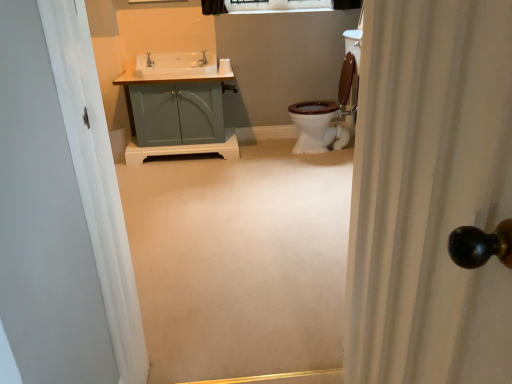
The height and width of the screenshot is (384, 512). Describe the element at coordinates (202, 60) in the screenshot. I see `matte silver faucet at upper center` at that location.

What is the approximate height of white glossy sink at upper left?

The height of white glossy sink at upper left is 7.50 inches.

Describe the element at coordinates (175, 64) in the screenshot. I see `white glossy sink at upper left` at that location.

This screenshot has height=384, width=512. What do you see at coordinates (177, 108) in the screenshot?
I see `matte teal cabinet at center` at bounding box center [177, 108].

This screenshot has width=512, height=384. Identify the location of matte teal cabinet at center. (177, 108).

Locate an element on the screen. matte silver faucet at upper center is located at coordinates (202, 60).

Considering the relative sizes of white textured shower curtain at right and white matte toilet paper at upper center in the image provided, is white textured shower curtain at right smaller than white matte toilet paper at upper center?

No.

Is white textured shower curtain at right next to white matte toilet paper at upper center?

No, white textured shower curtain at right is not beside white matte toilet paper at upper center.

Is the depth of white textured shower curtain at right less than that of white matte toilet paper at upper center?

Yes, the depth of white textured shower curtain at right is less than that of white matte toilet paper at upper center.

Does white textured shower curtain at right turn towards white matte toilet paper at upper center?

Result: No, white textured shower curtain at right is not facing towards white matte toilet paper at upper center.

What's the angular difference between white textured shower curtain at right and white glossy sink at upper left's facing directions?

The facing directions of white textured shower curtain at right and white glossy sink at upper left are 91.6 degrees apart.

Identify the location of shower curtain in front of the white glossy sink at upper left. The width and height of the screenshot is (512, 384). (430, 193).

Does white textured shower curtain at right appear on the right side of white glossy sink at upper left?

Correct, you'll find white textured shower curtain at right to the right of white glossy sink at upper left.

Is white textured shower curtain at right in contact with white glossy sink at upper left?

No, white textured shower curtain at right is not beside white glossy sink at upper left.

Which point is more distant from viewer, (156,108) or (197,65)?

The point (197,65) is farther.

Is matte teal cabinet at center located outside matte silver faucet at upper center?

Indeed, matte teal cabinet at center is completely outside matte silver faucet at upper center.

Is matte teal cabinet at center aimed at matte silver faucet at upper center?

No, matte teal cabinet at center is not aimed at matte silver faucet at upper center.

Considering the positions of objects matte teal cabinet at center and matte silver faucet at upper center in the image provided, who is more to the right, matte teal cabinet at center or matte silver faucet at upper center?

Positioned to the right is matte silver faucet at upper center.

Which is correct: clear glass window at upper center is inside matte teal cabinet at center, or outside of it?

clear glass window at upper center is spatially situated outside matte teal cabinet at center.

Is point (319, 2) behind point (158, 57)?

Yes, point (319, 2) is behind point (158, 57).

Relative to matte teal cabinet at center, is clear glass window at upper center in front or behind?

clear glass window at upper center is behind matte teal cabinet at center.

Looking at this image, from the image's perspective, is white glossy sink at upper left located above or below matte teal cabinet at center?

Based on their image positions, white glossy sink at upper left is located above matte teal cabinet at center.

Measure the distance from white glossy sink at upper left to matte teal cabinet at center.

white glossy sink at upper left is 9.07 inches from matte teal cabinet at center.

Considering the relative positions of white glossy sink at upper left and matte teal cabinet at center in the image provided, is white glossy sink at upper left to the right of matte teal cabinet at center from the viewer's perspective?

Incorrect, white glossy sink at upper left is not on the right side of matte teal cabinet at center.

Considering the sizes of objects matte teal cabinet at center and white glossy sink at upper left in the image provided, who is bigger, matte teal cabinet at center or white glossy sink at upper left?

With larger size is matte teal cabinet at center.

Is matte teal cabinet at center at the left side of white glossy sink at upper left?

No.

Is matte teal cabinet at center taller or shorter than white glossy sink at upper left?

Considering their sizes, matte teal cabinet at center has more height than white glossy sink at upper left.

Where is `bathroom cabinet in front of the white glossy sink at upper left`? Image resolution: width=512 pixels, height=384 pixels. bathroom cabinet in front of the white glossy sink at upper left is located at coordinates (177, 108).

How different are the orientations of white textured shower curtain at right and matte silver faucet at upper left in degrees?

178 degrees separate the facing orientations of white textured shower curtain at right and matte silver faucet at upper left.

Does white textured shower curtain at right have a lesser height compared to matte silver faucet at upper left?

Incorrect, the height of white textured shower curtain at right does not fall short of that of matte silver faucet at upper left.

Does white textured shower curtain at right lie behind matte silver faucet at upper left?

No, it is in front of matte silver faucet at upper left.

In the scene shown: Which of these two, white textured shower curtain at right or matte silver faucet at upper left, is thinner?

matte silver faucet at upper left is thinner.

You are a GUI agent. You are given a task and a screenshot of the screen. Output one action in this format:
    pyautogui.click(x=<x>, y=<y>)
    Task: Click on the shower curtain in front of the white matte toilet paper at upper center
    Image resolution: width=512 pixels, height=384 pixels.
    Given the screenshot: What is the action you would take?
    pyautogui.click(x=430, y=193)

I want to click on sink behind the white textured shower curtain at right, so click(175, 64).

Looking at the image, which one is located further to matte silver faucet at upper left, white glossy sink at upper left or clear glass window at upper center?

clear glass window at upper center lies further to matte silver faucet at upper left than the other object.

Looking at this image, based on their spatial positions, is matte silver faucet at upper left or matte silver faucet at upper center further from white matte toilet paper at upper center?

matte silver faucet at upper left is further to white matte toilet paper at upper center.

Looking at the image, which one is located further to matte teal cabinet at center, white matte toilet paper at upper center or matte silver faucet at upper left?

Among the two, white matte toilet paper at upper center is located further to matte teal cabinet at center.

Looking at the image, which one is located closer to white glossy sink at upper left, white textured shower curtain at right or matte silver faucet at upper left?

matte silver faucet at upper left lies closer to white glossy sink at upper left than the other object.

Estimate the real-world distances between objects in this image. Which object is further from matte silver faucet at upper left, white textured shower curtain at right or clear glass window at upper center?

white textured shower curtain at right is further to matte silver faucet at upper left.

From the image, which object appears to be nearer to white textured shower curtain at right, matte teal cabinet at center or white glossy sink at upper left?

matte teal cabinet at center lies closer to white textured shower curtain at right than the other object.

From the image, which object appears to be nearer to white matte toilet paper at upper center, matte teal cabinet at center or matte silver faucet at upper center?

matte silver faucet at upper center.

When comparing their distances from clear glass window at upper center, does white matte toilet paper at upper center or matte silver faucet at upper center seem further?

matte silver faucet at upper center.

Locate an element on the screen. tap between matte silver faucet at upper left and clear glass window at upper center from left to right is located at coordinates (202, 60).

Image resolution: width=512 pixels, height=384 pixels. What are the coordinates of `tap between white textured shower curtain at right and clear glass window at upper center in the front-back direction` in the screenshot? It's located at (202, 60).

Where is `toilet paper between matte silver faucet at upper center and matte teal cabinet at center vertically`? This screenshot has height=384, width=512. toilet paper between matte silver faucet at upper center and matte teal cabinet at center vertically is located at coordinates (224, 66).

Find the location of a particular element. The image size is (512, 384). bathroom cabinet between white textured shower curtain at right and matte silver faucet at upper left in the front-back direction is located at coordinates 177,108.